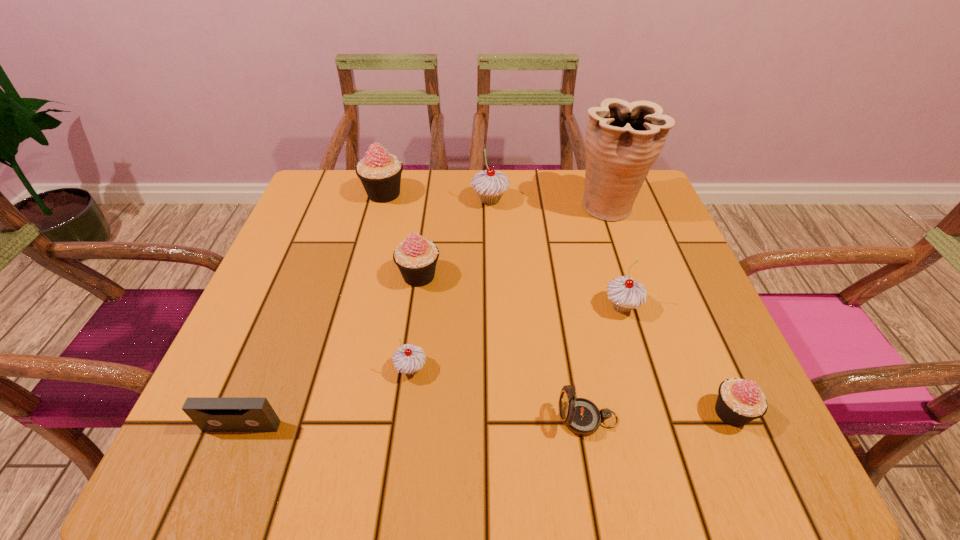
Find the location of a particular element. The width and height of the screenshot is (960, 540). the smallest gray cupcake is located at coordinates (408, 359).

I want to click on the leftmost gray cupcake, so click(408, 359).

The height and width of the screenshot is (540, 960). In order to click on the rightmost cupcake in this screenshot , I will do `click(739, 401)`.

The height and width of the screenshot is (540, 960). I want to click on the nearest cupcake, so click(x=739, y=401).

Find the location of a particular element. the shortest object is located at coordinates (211, 414).

Locate an element on the screen. videotape is located at coordinates (211, 414).

At what (x,y) coordinates should I click in order to perform the action: click on free space located 0.090m on the back of the tallest object. Please return your answer as a coordinate pair (x, y). Looking at the image, I should click on (595, 170).

Where is `free space located 0.170m on the left of the farthest gray cupcake`? free space located 0.170m on the left of the farthest gray cupcake is located at coordinates (405, 200).

This screenshot has width=960, height=540. Find the location of `blank space located on the right of the leftmost pink cupcake`. blank space located on the right of the leftmost pink cupcake is located at coordinates (444, 194).

Locate an element on the screen. The width and height of the screenshot is (960, 540). vacant space located 0.210m on the front of the second nearest gray cupcake is located at coordinates (657, 421).